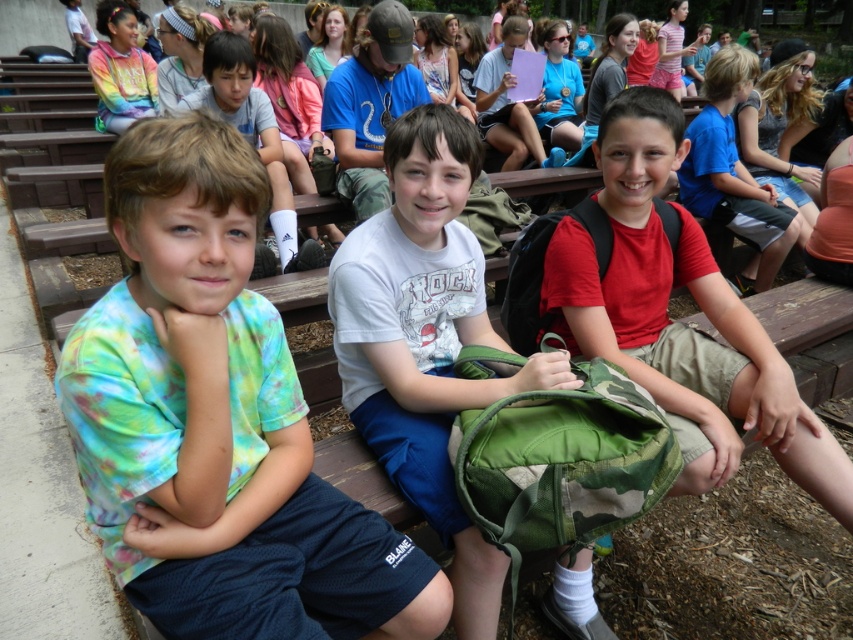
Looking at this image, you are a photographer trying to capture a closeup of the backpack the middle boy is holding. You are standing at the position of the boy on the left. Which point, point A at coordinates point (x=114, y=296) or point B at coordinates point (x=148, y=84), would be closer to your current position?

Point A at coordinates point (x=114, y=296) is closer to the camera than point B at coordinates point (x=148, y=84), so if you are standing at the position of the boy on the left, point A would be closer to your current position.